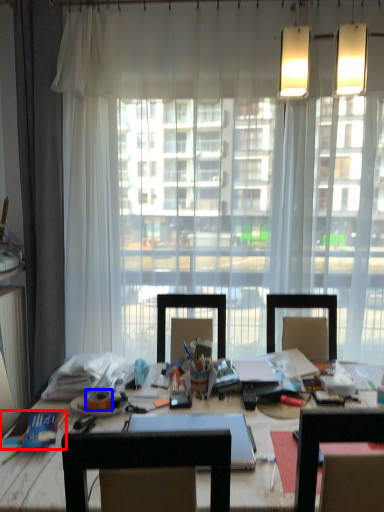
Question: Which point is closer to the camera, book (highlighted by a red box) or adhesive tape (highlighted by a blue box)?

Choices:
 (A) book
 (B) adhesive tape

Answer: (A)